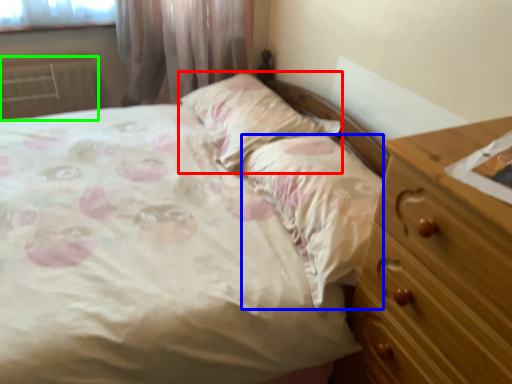
Question: Estimate the real-world distances between objects in this image. Which object is closer to pillow (highlighted by a red box), sheet (highlighted by a blue box) or radiator (highlighted by a green box)?

Choices:
 (A) sheet
 (B) radiator

Answer: (A)